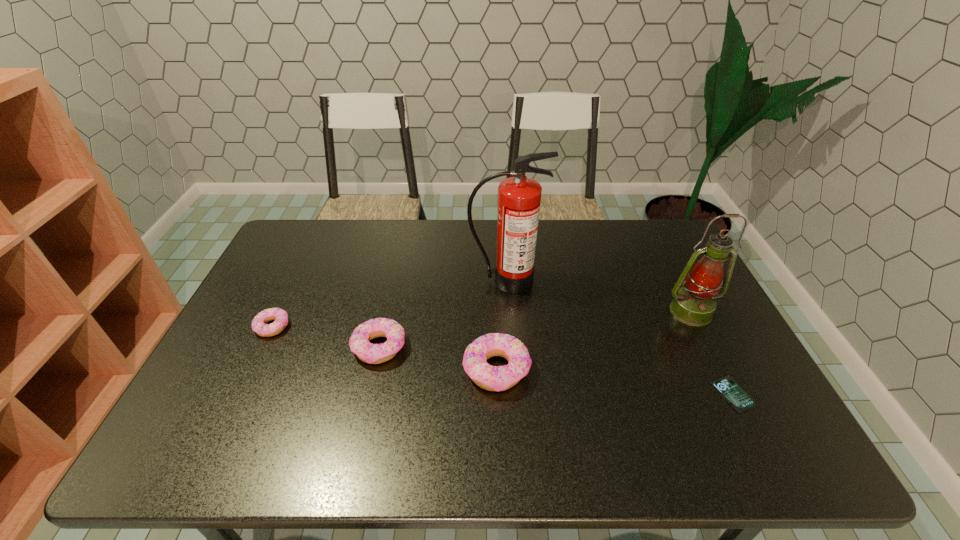
The width and height of the screenshot is (960, 540). I want to click on vacant space that's between the leftmost doughnut and the oil lamp, so click(482, 319).

Locate an element on the screen. free spot between the second doughnut from left to right and the oil lamp is located at coordinates (535, 329).

Locate an element on the screen. The width and height of the screenshot is (960, 540). free area in between the second tallest doughnut and the identity card is located at coordinates (556, 370).

Locate an element on the screen. The width and height of the screenshot is (960, 540). vacant area that lies between the fifth shortest object and the tallest object is located at coordinates [x=598, y=296].

The image size is (960, 540). Identify the location of unoccupied area between the second tallest object and the rightmost doughnut. (593, 340).

Find the location of a particular element. blank region between the second doughnut from right to left and the rightmost doughnut is located at coordinates pos(438,358).

The height and width of the screenshot is (540, 960). Identify the location of vacant point located between the identity card and the second tallest doughnut. (556, 370).

At what (x,y) coordinates should I click in order to perform the action: click on object that stands as the second closest to the oil lamp. Please return your answer as a coordinate pair (x, y). The image size is (960, 540). Looking at the image, I should click on (519, 197).

This screenshot has height=540, width=960. I want to click on object that stands as the fourth closest to the fourth tallest object, so click(694, 305).

The image size is (960, 540). I want to click on doughnut that is the second closest to the fire extinguisher, so click(x=359, y=342).